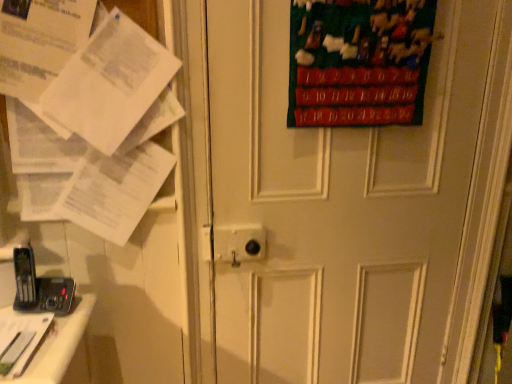
Question: Is black plastic phone at lower left at the left side of white paper at left?

Choices:
 (A) no
 (B) yes

Answer: (B)

Question: Does black plastic phone at lower left have a larger size compared to white paper at left?

Choices:
 (A) yes
 (B) no

Answer: (B)

Question: From a real-world perspective, is black plastic phone at lower left positioned under white paper at left based on gravity?

Choices:
 (A) yes
 (B) no

Answer: (A)

Question: Is black plastic phone at lower left in contact with white paper at left?

Choices:
 (A) yes
 (B) no

Answer: (B)

Question: From a real-world perspective, is black plastic phone at lower left on white paper at left?

Choices:
 (A) no
 (B) yes

Answer: (A)

Question: In terms of height, does velvet green poster at upper right look taller or shorter compared to white paper at left?

Choices:
 (A) short
 (B) tall

Answer: (A)

Question: Looking at the image, does velvet green poster at upper right seem bigger or smaller compared to white paper at left?

Choices:
 (A) big
 (B) small

Answer: (B)

Question: Is velvet green poster at upper right wider or thinner than white paper at left?

Choices:
 (A) wide
 (B) thin

Answer: (A)

Question: Is velvet green poster at upper right spatially inside white paper at left, or outside of it?

Choices:
 (A) inside
 (B) outside

Answer: (B)

Question: Is velvet green poster at upper right wider or thinner than black plastic phone at lower left?

Choices:
 (A) wide
 (B) thin

Answer: (A)

Question: Looking at the image, does velvet green poster at upper right seem bigger or smaller compared to black plastic phone at lower left?

Choices:
 (A) small
 (B) big

Answer: (B)

Question: From a real-world perspective, is velvet green poster at upper right physically located above or below black plastic phone at lower left?

Choices:
 (A) above
 (B) below

Answer: (A)

Question: Considering the positions of point (313, 56) and point (31, 274), is point (313, 56) closer or farther from the camera than point (31, 274)?

Choices:
 (A) farther
 (B) closer

Answer: (A)

Question: From a real-world perspective, is white matte door at center positioned above or below black plastic phone at lower left?

Choices:
 (A) below
 (B) above

Answer: (B)

Question: Is point (297, 316) closer or farther from the camera than point (32, 276)?

Choices:
 (A) closer
 (B) farther

Answer: (B)